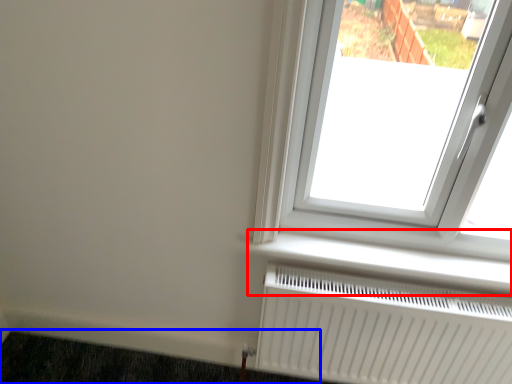
Question: Among these objects, which one is nearest to the camera, window sill (highlighted by a red box) or doormat (highlighted by a blue box)?

Choices:
 (A) window sill
 (B) doormat

Answer: (A)